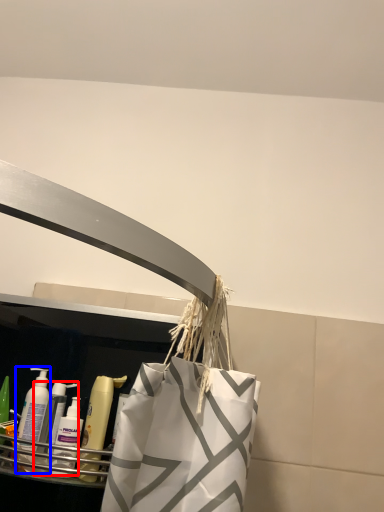
Question: Which of the following is the farthest to the observer, cleaning product (highlighted by a red box) or cleaning product (highlighted by a blue box)?

Choices:
 (A) cleaning product
 (B) cleaning product

Answer: (B)